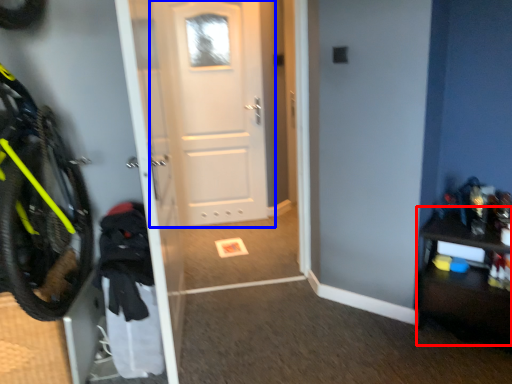
Question: Among these objects, which one is nearest to the camera, dresser (highlighted by a red box) or door (highlighted by a blue box)?

Choices:
 (A) dresser
 (B) door

Answer: (A)